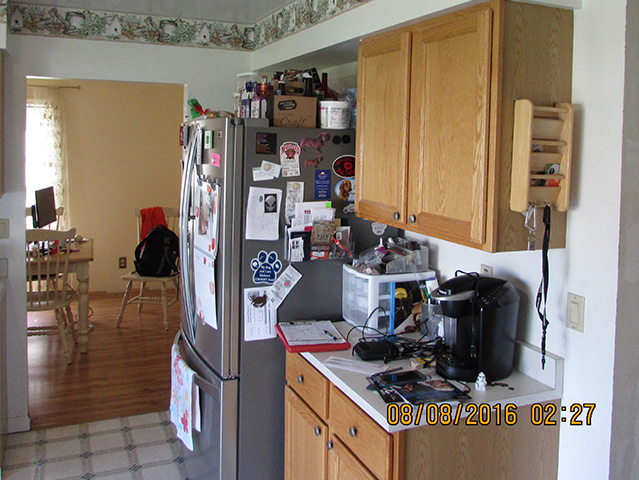
Image resolution: width=639 pixels, height=480 pixels. What are the coordinates of `wooden floor` in the screenshot? It's located at (121, 371).